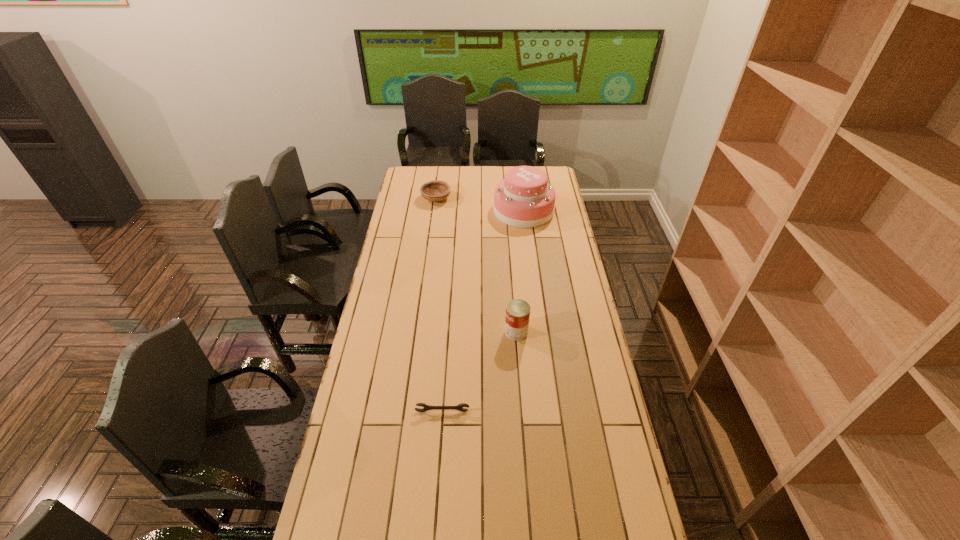
This screenshot has height=540, width=960. What are the coordinates of `vacant region between the second shortest object and the tallest object` in the screenshot? It's located at (480, 205).

You are a GUI agent. You are given a task and a screenshot of the screen. Output one action in this format:
    pyautogui.click(x=<x>, y=<y>)
    Task: Click on the free spot between the third tallest object and the cake
    Image resolution: width=960 pixels, height=540 pixels.
    Given the screenshot: What is the action you would take?
    pyautogui.click(x=480, y=205)

The height and width of the screenshot is (540, 960). I want to click on the closest object relative to the shortest object, so click(517, 311).

What are the coordinates of `the second closest object to the second shortest object` in the screenshot? It's located at (517, 311).

The width and height of the screenshot is (960, 540). I want to click on free space in the image that satisfies the following two spatial constraints: 1. on the front label of the can; 2. on the open ends of the wrench, so click(x=522, y=411).